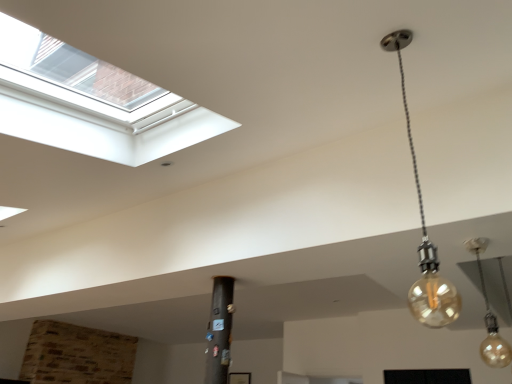
Question: Is translucent glass bulb at lower right, the first lamp in the back-to-front sequence, spatially inside translucent amber bulb at upper right, the first lamp when ordered from top to bottom, or outside of it?

Choices:
 (A) outside
 (B) inside

Answer: (A)

Question: From a real-world perspective, is translucent glass bulb at lower right, marked as the second lamp in a front-to-back arrangement, physically located above or below translucent amber bulb at upper right, the first lamp when ordered from top to bottom?

Choices:
 (A) above
 (B) below

Answer: (B)

Question: Is translucent glass bulb at lower right, which is the second lamp from left to right, wider or thinner than translucent amber bulb at upper right, the second lamp when ordered from right to left?

Choices:
 (A) thin
 (B) wide

Answer: (A)

Question: Would you say translucent amber bulb at upper right, the first lamp when ordered from top to bottom, is to the left or to the right of translucent glass bulb at lower right, which is the first lamp in bottom-to-top order, in the picture?

Choices:
 (A) left
 (B) right

Answer: (A)

Question: Is translucent amber bulb at upper right, which ranks as the 2th lamp in back-to-front order, inside the boundaries of translucent glass bulb at lower right, marked as the second lamp in a front-to-back arrangement, or outside?

Choices:
 (A) inside
 (B) outside

Answer: (B)

Question: Looking at the image, does translucent amber bulb at upper right, marked as the second lamp in a bottom-to-top arrangement, seem bigger or smaller compared to translucent glass bulb at lower right, acting as the 1th lamp starting from the right?

Choices:
 (A) small
 (B) big

Answer: (B)

Question: Is point (415, 168) closer or farther from the camera than point (501, 352)?

Choices:
 (A) closer
 (B) farther

Answer: (A)